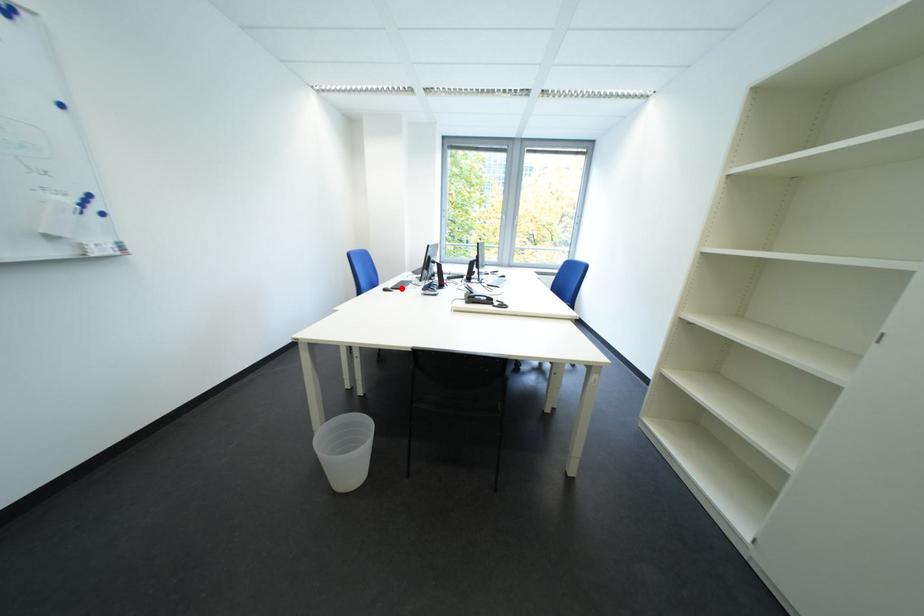
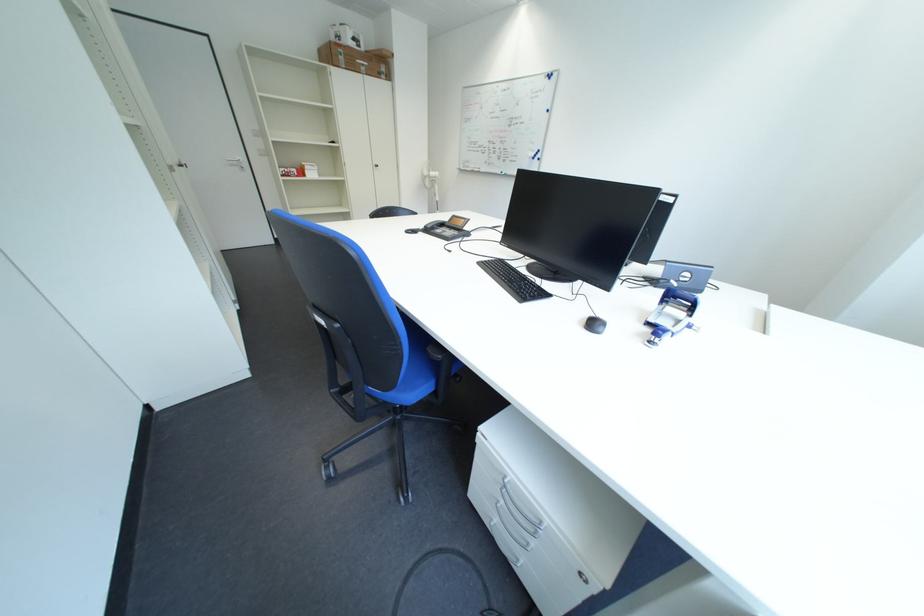
Question: I am providing you with two images of the same scene from different viewpoints. A red point is marked on the first image. At the location where the point appears in image 1, is it still visible in image 2?

Choices:
 (A) Yes
 (B) No

Answer: (B)